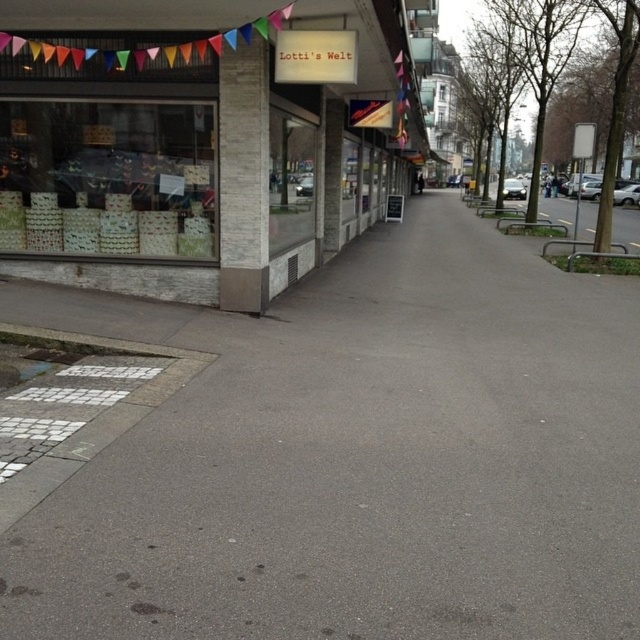
Question: Is gray asphalt pavement at center below matte glass storefront at upper left?

Choices:
 (A) yes
 (B) no

Answer: (A)

Question: Does gray asphalt pavement at center lie in front of matte glass storefront at upper left?

Choices:
 (A) yes
 (B) no

Answer: (A)

Question: Does gray asphalt pavement at center appear on the right side of matte glass storefront at upper left?

Choices:
 (A) yes
 (B) no

Answer: (A)

Question: Which object is closer to the camera taking this photo?

Choices:
 (A) gray asphalt pavement at center
 (B) matte glass storefront at upper left

Answer: (A)

Question: Which object appears closest to the camera in this image?

Choices:
 (A) matte glass storefront at upper left
 (B) gray asphalt pavement at center

Answer: (B)